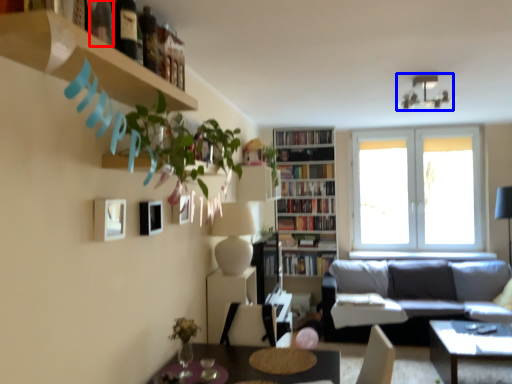
Question: Which point is further to the camera, wine bottle (highlighted by a red box) or lamp (highlighted by a blue box)?

Choices:
 (A) wine bottle
 (B) lamp

Answer: (B)